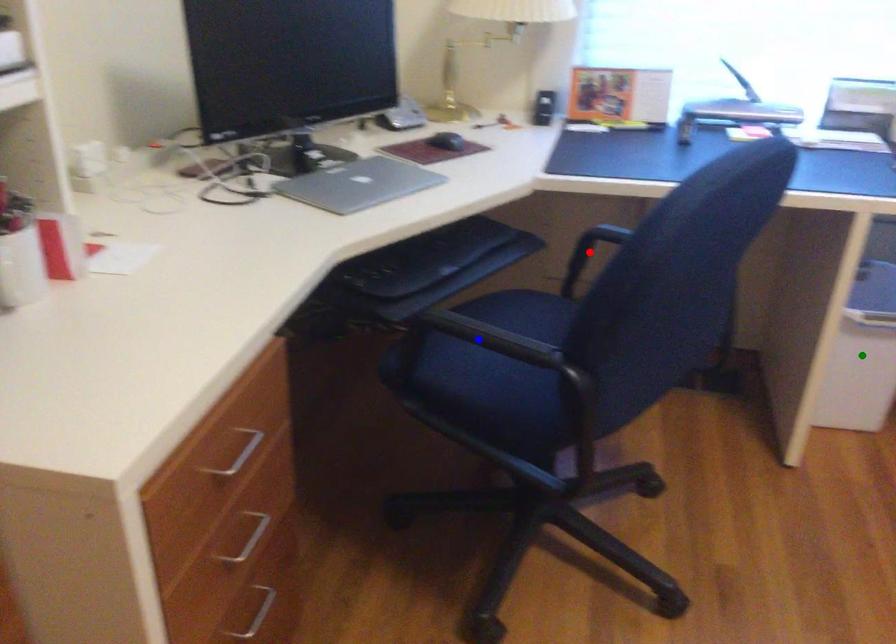
Order these from nearest to farthest:
red point
green point
blue point

1. red point
2. blue point
3. green point